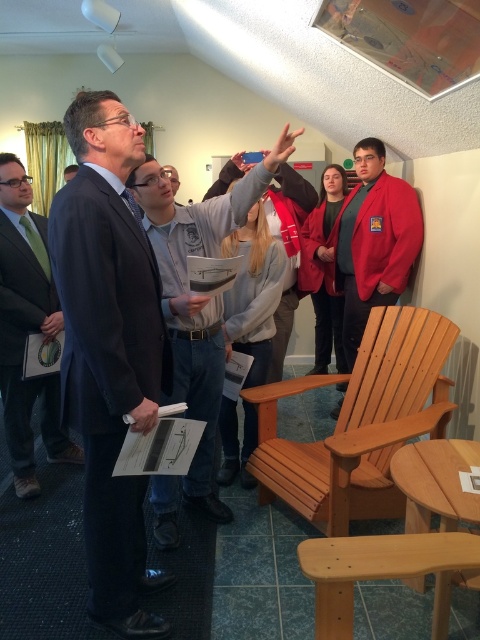
You are standing in the room and want to walk directly towards the dark blue suit at center. Which direction should you move in relative to your current position?

Since the dark blue suit at center is located at coordinates point (109, 349), you should move towards the center of the room to reach it.

You are organizing a small event and need to know the seating capacity. Based on the image, can the dark blue suit at center fit under the light brown wooden chair at lower right?

The dark blue suit at center is smaller than the light brown wooden chair at lower right, so it can fit under the light brown wooden chair at lower right.